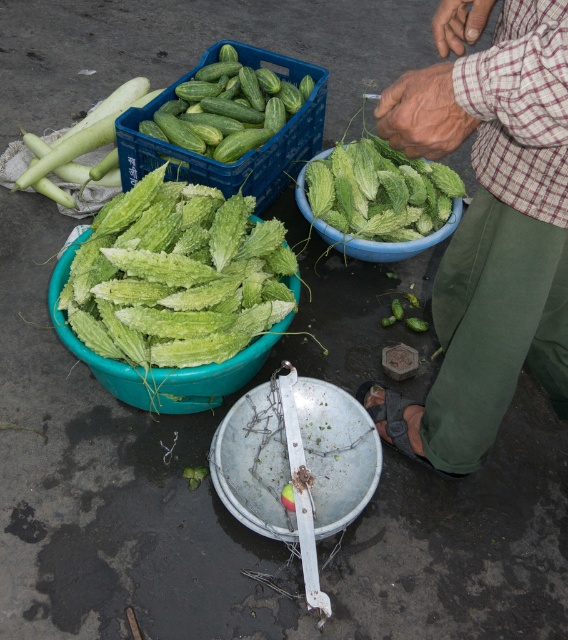
Who is taller, green leafy vegetable at center or smooth white cucumber at upper left?

smooth white cucumber at upper left is taller.

Is green leafy vegetable at center to the left of smooth white cucumber at upper left from the viewer's perspective?

No, green leafy vegetable at center is not to the left of smooth white cucumber at upper left.

Does point (83, 307) come closer to viewer compared to point (112, 112)?

That is True.

This screenshot has height=640, width=568. I want to click on green leafy vegetable at center, so click(178, 276).

Which is behind, point (540, 177) or point (304, 218)?

The point (304, 218) is more distant.

Can you confirm if green plaid shirt at upper right is positioned to the left of green leafy bowl at center?

No, green plaid shirt at upper right is not to the left of green leafy bowl at center.

This screenshot has height=640, width=568. What do you see at coordinates (491, 230) in the screenshot?
I see `green plaid shirt at upper right` at bounding box center [491, 230].

Identify the location of green plaid shirt at upper right. The height and width of the screenshot is (640, 568). (491, 230).

What do you see at coordinates (178, 276) in the screenshot? I see `green leafy vegetable at center` at bounding box center [178, 276].

Who is lower down, green leafy vegetable at center or green matte cucumbers at upper left?

Positioned lower is green leafy vegetable at center.

Measure the distance between point (x=111, y=288) and camera.

The distance of point (x=111, y=288) from camera is 5.19 feet.

Identify the location of green leafy vegetable at center. (178, 276).